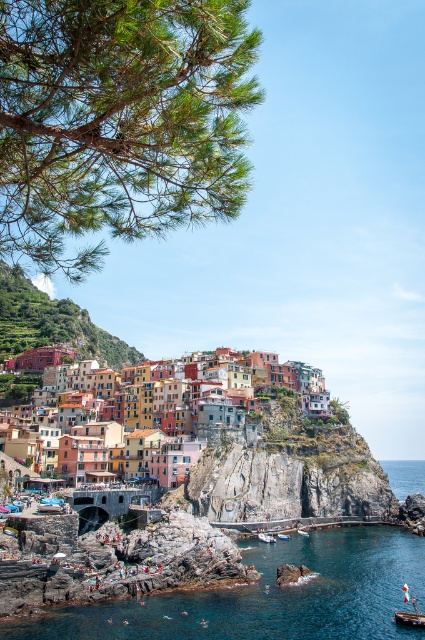
Question: Among these points, which one is nearest to the camera?

Choices:
 (A) (268, 538)
 (B) (268, 580)
 (C) (178, 481)
 (D) (285, 534)

Answer: (B)

Question: Among these points, which one is farthest from the camera?

Choices:
 (A) (266, 532)
 (B) (286, 538)

Answer: (B)

Question: Considering the real-world distances, which object is closest to the wooden boat at lower center?

Choices:
 (A) white plastic boat at lower center
 (B) clear blue water at lower center
 (C) multicolored stone village at center

Answer: (A)

Question: Is clear blue water at lower center below white plastic boat at lower center?

Choices:
 (A) yes
 (B) no

Answer: (B)

Question: Does multicolored stone village at center have a lesser width compared to wooden boat at lower center?

Choices:
 (A) no
 (B) yes

Answer: (A)

Question: Does multicolored stone village at center appear over wooden boat at lower center?

Choices:
 (A) yes
 (B) no

Answer: (A)